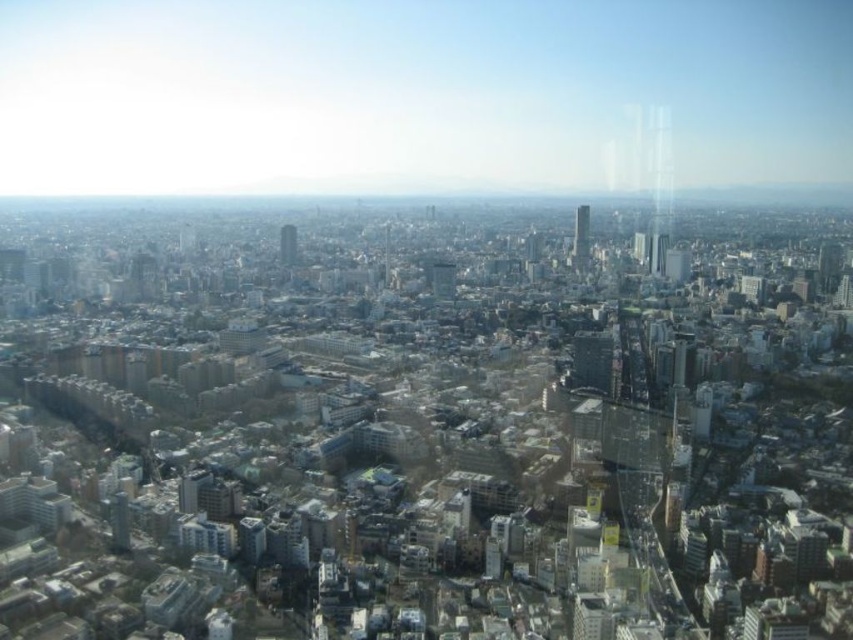
From the picture: Which is more to the left, green glass skyscraper at center or glassy skyscraper at center?

Positioned to the left is glassy skyscraper at center.

Is point (583, 216) positioned after point (283, 234)?

Yes, it is behind point (283, 234).

This screenshot has width=853, height=640. In order to click on green glass skyscraper at center in this screenshot , I will do `click(581, 236)`.

The image size is (853, 640). In order to click on green glass skyscraper at center in this screenshot , I will do `click(581, 236)`.